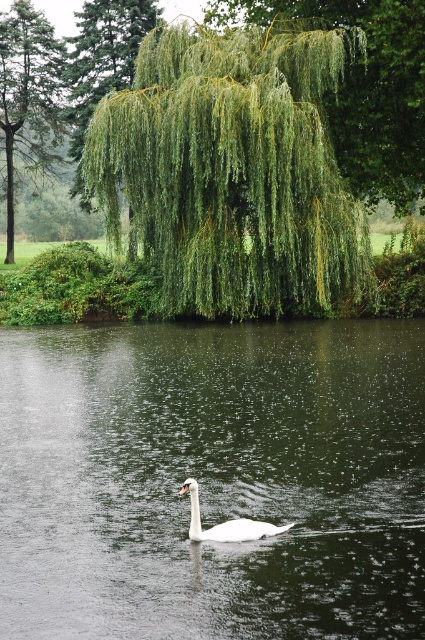
Question: Among these objects, which one is nearest to the camera?

Choices:
 (A) green leafy tree at upper center
 (B) green leafy willow at upper center
 (C) white glossy swan at center
 (D) green leafy tree at upper left

Answer: (C)

Question: Is green leafy willow at upper center positioned behind green leafy tree at upper center?

Choices:
 (A) no
 (B) yes

Answer: (A)

Question: Which object is the farthest from the green leafy tree at upper center?

Choices:
 (A) white glossy swan at center
 (B) green leafy willow at upper center

Answer: (A)

Question: Is clear water at center smaller than green leafy tree at upper left?

Choices:
 (A) yes
 (B) no

Answer: (A)

Question: Which of the following is the farthest from the observer?

Choices:
 (A) (285, 1)
 (B) (292, 216)
 (C) (235, 524)

Answer: (A)

Question: Is green leafy tree at upper center bigger than green leafy tree at upper left?

Choices:
 (A) no
 (B) yes

Answer: (B)